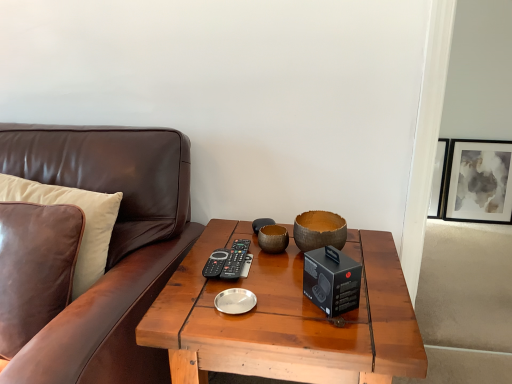
The height and width of the screenshot is (384, 512). Describe the element at coordinates (109, 246) in the screenshot. I see `brown leather couch at left` at that location.

Locate an element on the screen. Image resolution: width=512 pixels, height=384 pixels. matte black picture frame at upper right is located at coordinates (479, 181).

The width and height of the screenshot is (512, 384). What are the coordinates of `brown leather couch at left` in the screenshot? It's located at (109, 246).

Does natural wood bowl at center contain matte black picture frame at upper right?

No, matte black picture frame at upper right is located outside of natural wood bowl at center.

Between natural wood bowl at center and matte black picture frame at upper right, which one has smaller width?

Thinner between the two is matte black picture frame at upper right.

Considering the positions of points (303, 233) and (460, 183), is point (303, 233) farther from camera compared to point (460, 183)?

No, it is in front of (460, 183).

Does natural wood bowl at center have a greater height compared to matte black picture frame at upper right?

Incorrect, the height of natural wood bowl at center is not larger of that of matte black picture frame at upper right.

Which is more distant, (449, 207) or (5, 191)?

The point (449, 207) is farther.

Does matte black picture frame at upper right have a lesser width compared to leather pillow at left?

Yes, matte black picture frame at upper right is thinner than leather pillow at left.

Can you confirm if matte black picture frame at upper right is smaller than leather pillow at left?

Yes, matte black picture frame at upper right is smaller than leather pillow at left.

The height and width of the screenshot is (384, 512). I want to click on picture frame that appears behind the leather pillow at left, so [479, 181].

Is natural wood bowl at center facing away from brown leather couch at left?

No, natural wood bowl at center's orientation is not away from brown leather couch at left.

Measure the distance from natural wood bowl at center to brown leather couch at left.

natural wood bowl at center and brown leather couch at left are 20.60 inches apart from each other.

Which is more distant, (x=310, y=245) or (x=71, y=162)?

The point (x=71, y=162) is farther from the camera.

Is natural wood bowl at center to the right of wooden coffee table at center from the viewer's perspective?

Yes.

Is point (307, 215) behind point (151, 341)?

Yes, point (307, 215) is behind point (151, 341).

From a real-world perspective, is natural wood bowl at center physically located above or below wooden coffee table at center?

From a real-world perspective, natural wood bowl at center is physically above wooden coffee table at center.

Considering the sizes of natural wood bowl at center and wooden coffee table at center in the image, is natural wood bowl at center bigger or smaller than wooden coffee table at center?

Considering their sizes, natural wood bowl at center takes up less space than wooden coffee table at center.

Between wooden coffee table at center and matte black picture frame at upper right, which one has smaller width?

With smaller width is matte black picture frame at upper right.

From a real-world perspective, is wooden coffee table at center beneath matte black picture frame at upper right?

No, from a real-world perspective, wooden coffee table at center is not below matte black picture frame at upper right.

From the image's perspective, relative to matte black picture frame at upper right, is wooden coffee table at center above or below?

Based on their image positions, wooden coffee table at center is located beneath matte black picture frame at upper right.

At what (x,y) coordinates should I click in order to perform the action: click on pillow above the wooden coffee table at center (from a real-world perspective). Please return your answer as a coordinate pair (x, y). The width and height of the screenshot is (512, 384). Looking at the image, I should click on (85, 221).

Considering the relative positions of leather pillow at left and wooden coffee table at center in the image provided, is leather pillow at left behind wooden coffee table at center?

That is True.

Is leather pillow at left to the right of wooden coffee table at center from the viewer's perspective?

Incorrect, leather pillow at left is not on the right side of wooden coffee table at center.

This screenshot has width=512, height=384. I want to click on pillow located behind the brown leather couch at left, so click(85, 221).

How distant is leather pillow at left from brown leather couch at left?

A distance of 5.26 inches exists between leather pillow at left and brown leather couch at left.

Based on their sizes in the image, would you say leather pillow at left is bigger or smaller than brown leather couch at left?

Clearly, leather pillow at left is smaller in size than brown leather couch at left.

Locate an element on the screen. This screenshot has width=512, height=384. picture frame located behind the natural wood bowl at center is located at coordinates (479, 181).

You are a GUI agent. You are given a task and a screenshot of the screen. Output one action in this format:
    pyautogui.click(x=<x>, y=<y>)
    Task: Click on the picture frame above the leather pillow at left (from the image's perspective)
    
    Given the screenshot: What is the action you would take?
    pyautogui.click(x=479, y=181)

Looking at the image, which one is located further to matte black picture frame at upper right, leather pillow at left or wooden coffee table at center?

leather pillow at left is positioned further to the anchor matte black picture frame at upper right.

Estimate the real-world distances between objects in this image. Which object is further from wooden coffee table at center, natural wood bowl at center or matte black picture frame at upper right?

Among the two, matte black picture frame at upper right is located further to wooden coffee table at center.

Looking at the image, which one is located closer to wooden coffee table at center, leather pillow at left or matte black picture frame at upper right?

Among the two, leather pillow at left is located nearer to wooden coffee table at center.

When comparing their distances from natural wood bowl at center, does brown leather couch at left or wooden coffee table at center seem closer?

wooden coffee table at center is closer to natural wood bowl at center.

Estimate the real-world distances between objects in this image. Which object is closer to brown leather couch at left, natural wood bowl at center or leather pillow at left?

leather pillow at left is positioned closer to the anchor brown leather couch at left.

From the image, which object appears to be nearer to natural wood bowl at center, wooden coffee table at center or leather pillow at left?

wooden coffee table at center is positioned closer to the anchor natural wood bowl at center.

From the picture: Considering their positions, is matte black picture frame at upper right positioned further to wooden coffee table at center than brown leather couch at left?

matte black picture frame at upper right.

Estimate the real-world distances between objects in this image. Which object is closer to matte black picture frame at upper right, natural wood bowl at center or wooden coffee table at center?

Based on the image, natural wood bowl at center appears to be nearer to matte black picture frame at upper right.

Find the location of a particular element. coffee table located between leather pillow at left and natural wood bowl at center in the left-right direction is located at coordinates tap(286, 318).

Locate an element on the screen. pillow situated between brown leather couch at left and matte black picture frame at upper right from left to right is located at coordinates (85, 221).

The image size is (512, 384). Identify the location of coffee table positioned between brown leather couch at left and matte black picture frame at upper right from near to far. (286, 318).

You are a GUI agent. You are given a task and a screenshot of the screen. Output one action in this format:
    pyautogui.click(x=<x>, y=<y>)
    Task: Click on the bowl positioned between wooden coffee table at center and matte black picture frame at upper right from near to far
    The height and width of the screenshot is (384, 512).
    Given the screenshot: What is the action you would take?
    pyautogui.click(x=319, y=230)